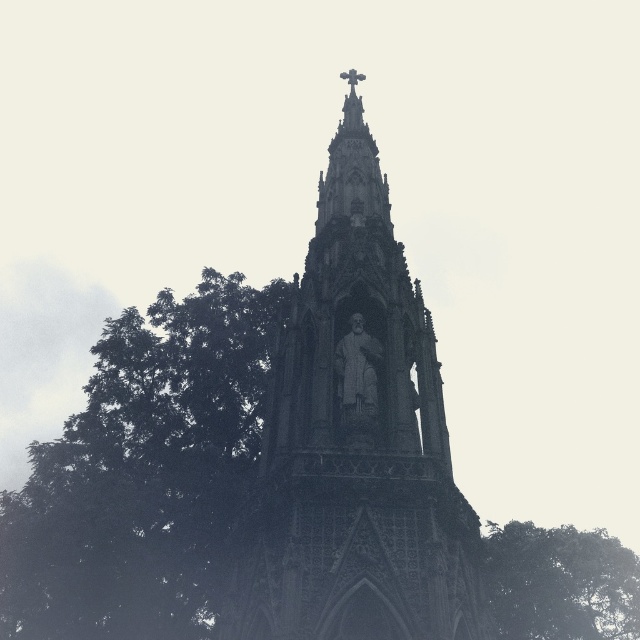
Question: Which point is closer to the camera?

Choices:
 (A) green leafy tree at lower right
 (B) green leafy tree at left

Answer: (A)

Question: Which point is farther from the camera taking this photo?

Choices:
 (A) (264, 332)
 (B) (388, 620)
 (C) (556, 634)

Answer: (C)

Question: Is green leafy tree at left thinner than green leafy tree at lower right?

Choices:
 (A) no
 (B) yes

Answer: (A)

Question: Is stone statue at center further to camera compared to green leafy tree at lower right?

Choices:
 (A) yes
 (B) no

Answer: (B)

Question: Does stone statue at center appear over green leafy tree at lower right?

Choices:
 (A) no
 (B) yes

Answer: (B)

Question: Which object is closer to the camera taking this photo?

Choices:
 (A) green leafy tree at left
 (B) green leafy tree at lower right

Answer: (B)